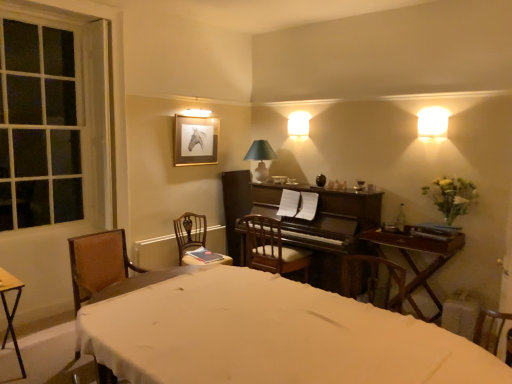
Question: From the image's perspective, does white matte vase at right appear lower than white fabric bed at lower left?

Choices:
 (A) no
 (B) yes

Answer: (A)

Question: Is white matte vase at right located outside white fabric bed at lower left?

Choices:
 (A) yes
 (B) no

Answer: (A)

Question: Considering the relative sizes of white matte vase at right and white fabric bed at lower left in the image provided, is white matte vase at right taller than white fabric bed at lower left?

Choices:
 (A) no
 (B) yes

Answer: (A)

Question: Considering the relative positions of white matte vase at right and white fabric bed at lower left in the image provided, is white matte vase at right to the left of white fabric bed at lower left from the viewer's perspective?

Choices:
 (A) no
 (B) yes

Answer: (A)

Question: Does white matte vase at right contain white fabric bed at lower left?

Choices:
 (A) no
 (B) yes

Answer: (A)

Question: Can you confirm if white matte vase at right is positioned to the right of white fabric bed at lower left?

Choices:
 (A) no
 (B) yes

Answer: (B)

Question: Is matte glass lampshade at upper center, which ranks as the first lamp in top-to-bottom order, further to the viewer compared to brown wooden chair at center, arranged as the 2th chair when viewed from the right?

Choices:
 (A) no
 (B) yes

Answer: (B)

Question: Does matte glass lampshade at upper center, acting as the second lamp starting from the left, have a lesser height compared to brown wooden chair at center, arranged as the 2th chair when viewed from the right?

Choices:
 (A) no
 (B) yes

Answer: (B)

Question: Can you confirm if matte glass lampshade at upper center, acting as the second lamp starting from the left, is positioned to the left of brown wooden chair at center, arranged as the 2th chair when viewed from the right?

Choices:
 (A) no
 (B) yes

Answer: (A)

Question: Would you consider matte glass lampshade at upper center, acting as the second lamp starting from the left, to be distant from brown wooden chair at center, placed as the 2th chair when sorted from left to right?

Choices:
 (A) no
 (B) yes

Answer: (B)

Question: Is matte glass lampshade at upper center, positioned as the 1th lamp in right-to-left order, with brown wooden chair at center, placed as the 2th chair when sorted from left to right?

Choices:
 (A) no
 (B) yes

Answer: (A)

Question: From a real-world perspective, is matte glass lampshade at upper center, acting as the second lamp starting from the left, on brown wooden chair at center, arranged as the 2th chair when viewed from the right?

Choices:
 (A) no
 (B) yes

Answer: (B)

Question: Does dark wood piano at center contain wooden chair with cushion at center, acting as the 1th chair starting from the right?

Choices:
 (A) no
 (B) yes

Answer: (B)